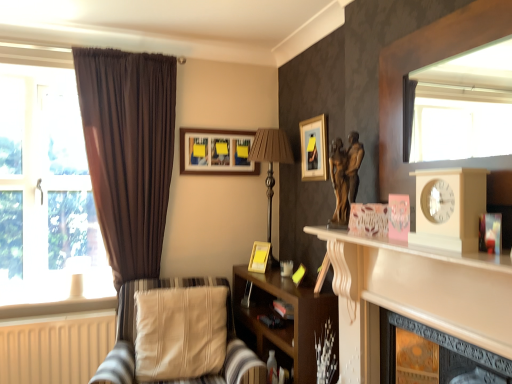
Question: Is beige wooden clock at right smaller than brown fabric lamp at center, acting as the first lamp starting from the right?

Choices:
 (A) no
 (B) yes

Answer: (B)

Question: Is beige wooden clock at right taller than brown fabric lamp at center, acting as the first lamp starting from the right?

Choices:
 (A) no
 (B) yes

Answer: (A)

Question: Is beige wooden clock at right bigger than brown fabric lamp at center, acting as the 1th lamp starting from the top?

Choices:
 (A) yes
 (B) no

Answer: (B)

Question: Is beige wooden clock at right positioned behind brown fabric lamp at center, acting as the first lamp starting from the right?

Choices:
 (A) yes
 (B) no

Answer: (B)

Question: Does beige wooden clock at right appear on the right side of brown fabric lamp at center, which appears as the 2th lamp when ordered from the bottom?

Choices:
 (A) yes
 (B) no

Answer: (A)

Question: From a real-world perspective, is beige wooden clock at right over brown fabric lamp at center, acting as the first lamp starting from the right?

Choices:
 (A) no
 (B) yes

Answer: (B)

Question: Considering the relative positions of bronze statue at center-right and wooden framed picture at upper center, which is counted as the first picture frame, starting from the left, in the image provided, is bronze statue at center-right behind wooden framed picture at upper center, which is counted as the first picture frame, starting from the left,?

Choices:
 (A) no
 (B) yes

Answer: (A)

Question: Does bronze statue at center-right have a smaller size compared to wooden framed picture at upper center, which is counted as the first picture frame, starting from the left?

Choices:
 (A) no
 (B) yes

Answer: (A)

Question: Can you confirm if bronze statue at center-right is shorter than wooden framed picture at upper center, which appears as the 1th picture frame when viewed from the top?

Choices:
 (A) yes
 (B) no

Answer: (B)

Question: Could you tell me if bronze statue at center-right is turned towards wooden framed picture at upper center, which is counted as the first picture frame, starting from the left?

Choices:
 (A) no
 (B) yes

Answer: (A)

Question: From a real-world perspective, is bronze statue at center-right located beneath wooden framed picture at upper center, which is counted as the first picture frame, starting from the left?

Choices:
 (A) yes
 (B) no

Answer: (A)

Question: Is bronze statue at center-right completely or partially outside of wooden framed picture at upper center, positioned as the first picture frame in back-to-front order?

Choices:
 (A) yes
 (B) no

Answer: (A)

Question: Is matte gold picture frame at upper center, which is the 3th picture frame in left-to-right order, to the left of transparent glass window at left from the viewer's perspective?

Choices:
 (A) yes
 (B) no

Answer: (B)